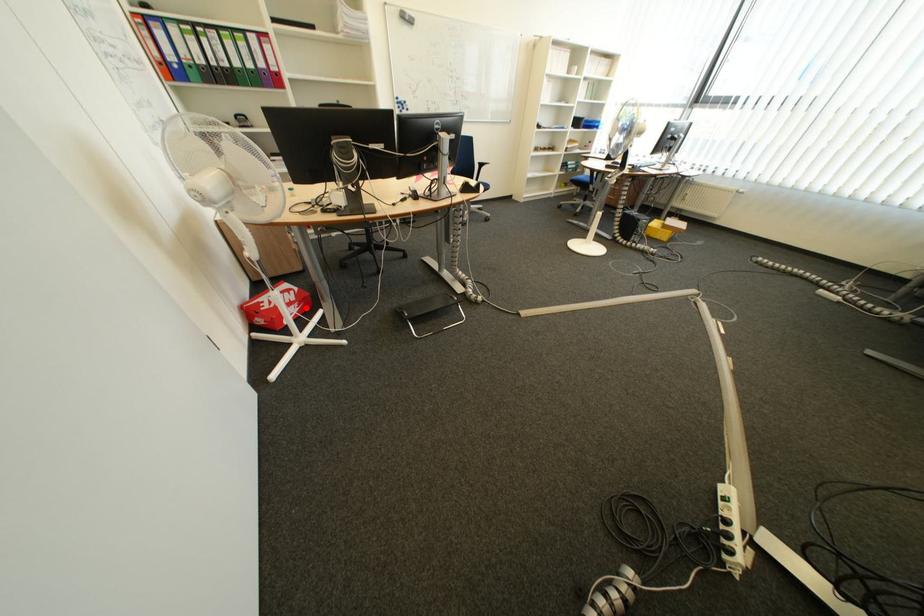
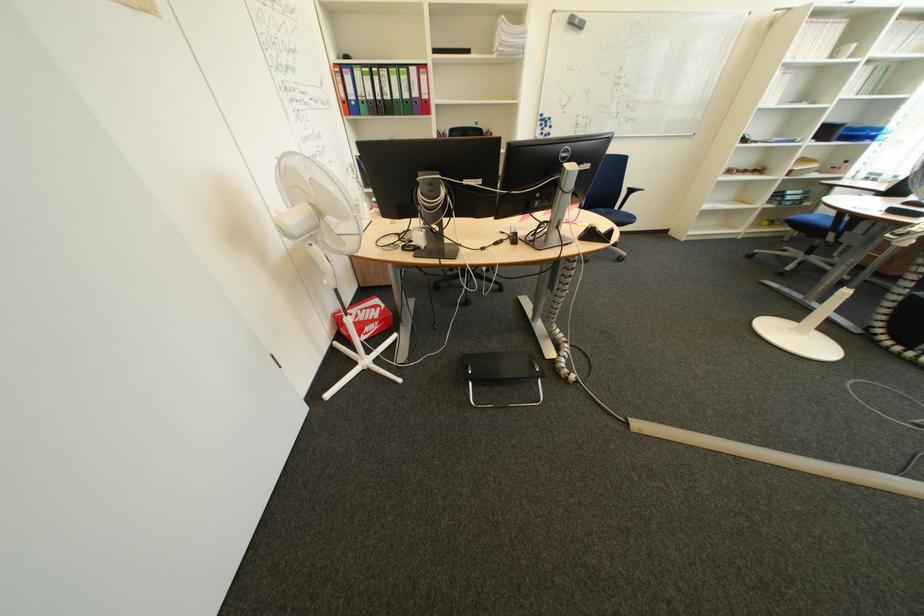
Question: I am providing you with two images of the same scene from different viewpoints. A red point is shown in image1. For the corresponding object point in image2, is it positioned nearer or farther from the camera?

Choices:
 (A) Nearer
 (B) Farther

Answer: (B)